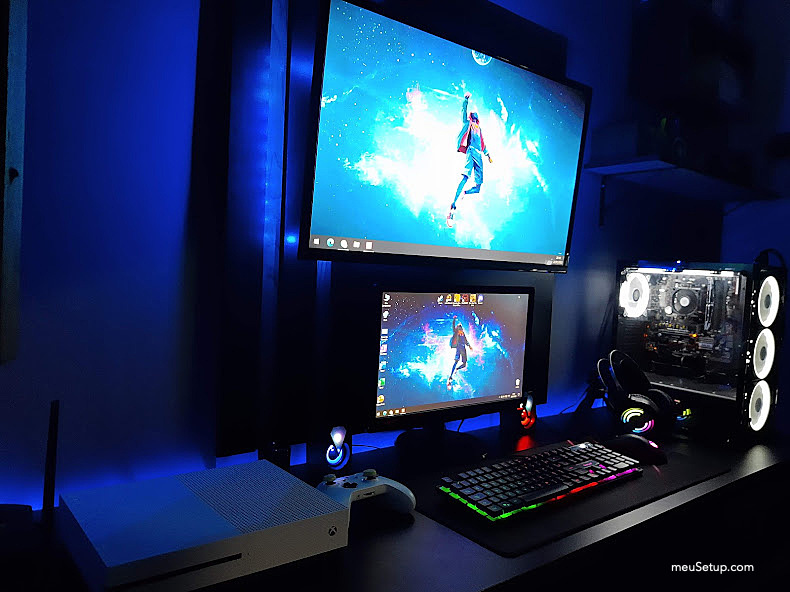
The width and height of the screenshot is (790, 592). What are the coordinates of `screen bezel` in the screenshot? It's located at (544, 285), (592, 98).